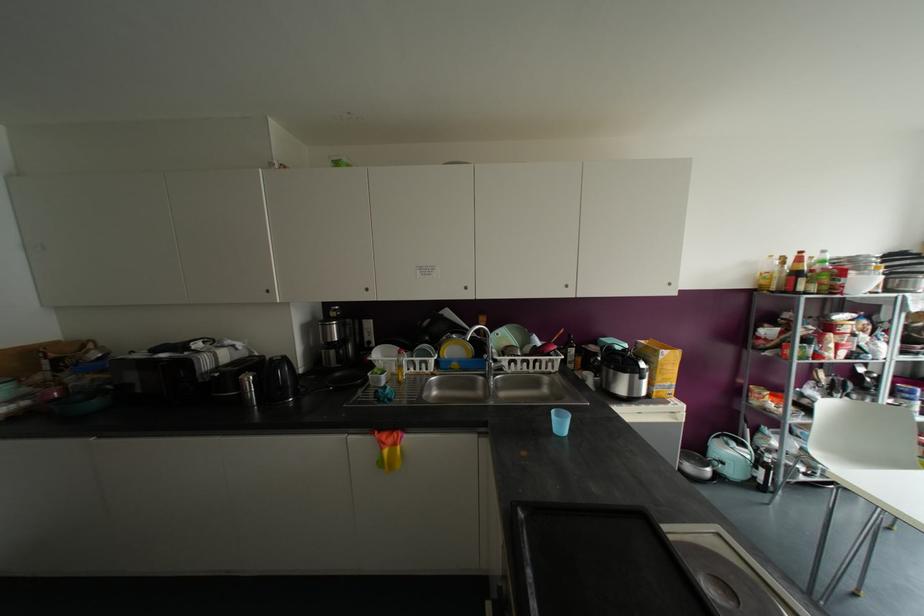
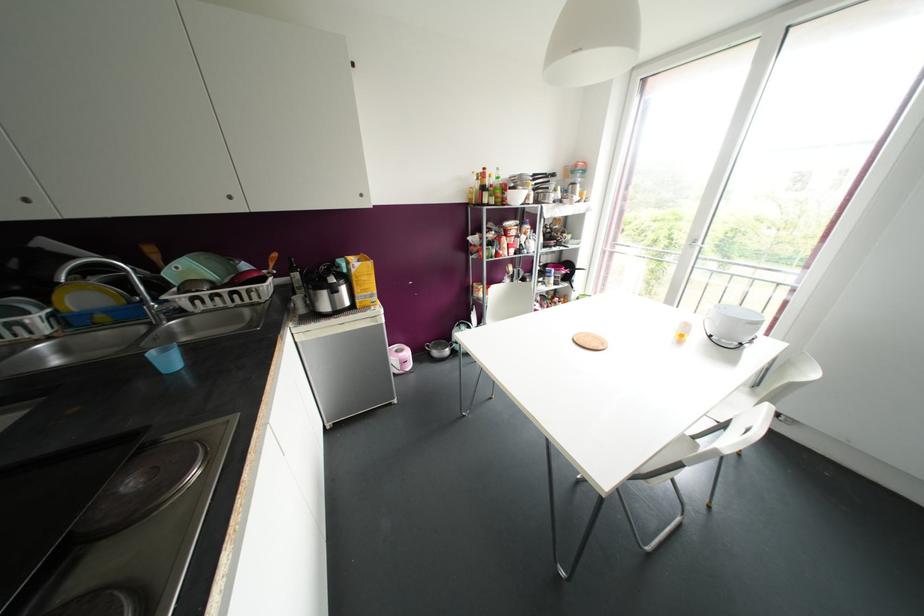
Where in the second image is the point corresponding to (x=669, y=367) from the first image?

(363, 277)